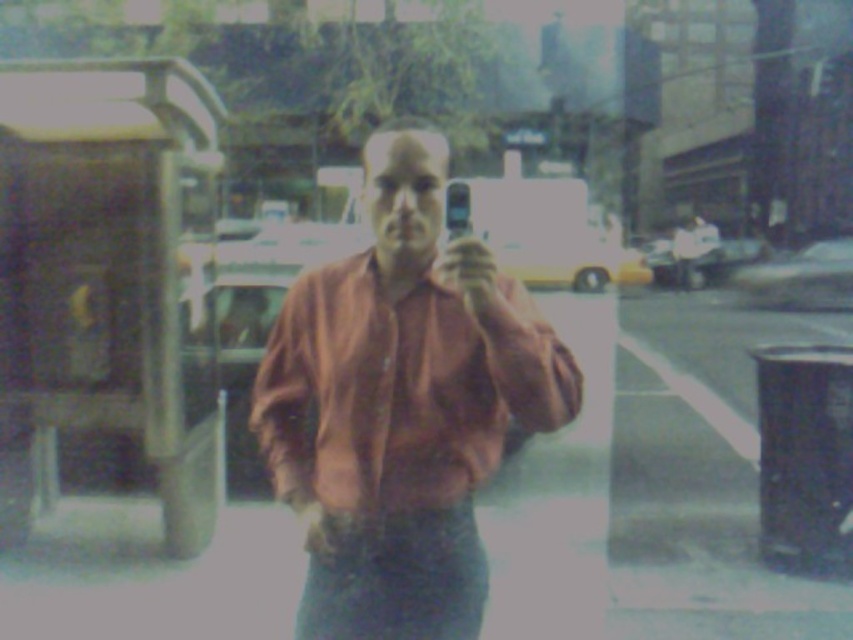
Question: Which point appears closest to the camera in this image?

Choices:
 (A) (367, 595)
 (B) (453, 340)

Answer: (B)

Question: Which point is closer to the camera?

Choices:
 (A) matte pink shirt at center
 (B) denim at lower center

Answer: (A)

Question: Does matte pink shirt at center appear under denim at lower center?

Choices:
 (A) yes
 (B) no

Answer: (B)

Question: Can you confirm if matte pink shirt at center is smaller than denim at lower center?

Choices:
 (A) yes
 (B) no

Answer: (B)

Question: Is matte pink shirt at center wider than denim at lower center?

Choices:
 (A) no
 (B) yes

Answer: (B)